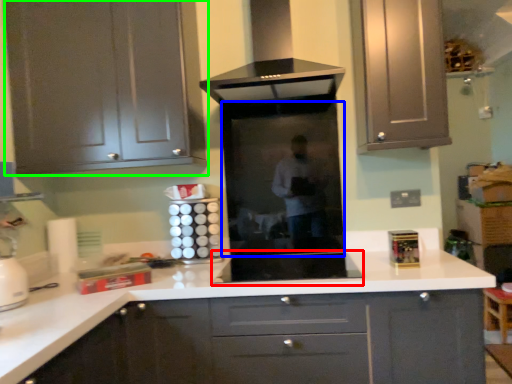
Question: Considering the real-world distances, which object is farthest from appliance (highlighted by a red box)? glass door (highlighted by a blue box) or cabinetry (highlighted by a green box)?

Choices:
 (A) glass door
 (B) cabinetry

Answer: (B)